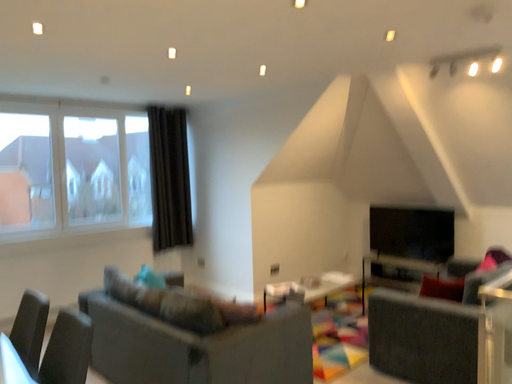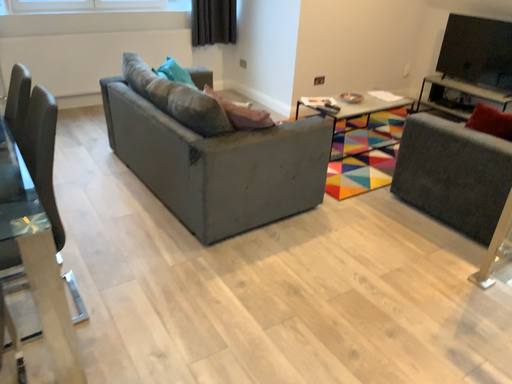
Question: Which way did the camera rotate in the video?

Choices:
 (A) rotated downward
 (B) rotated upward

Answer: (A)